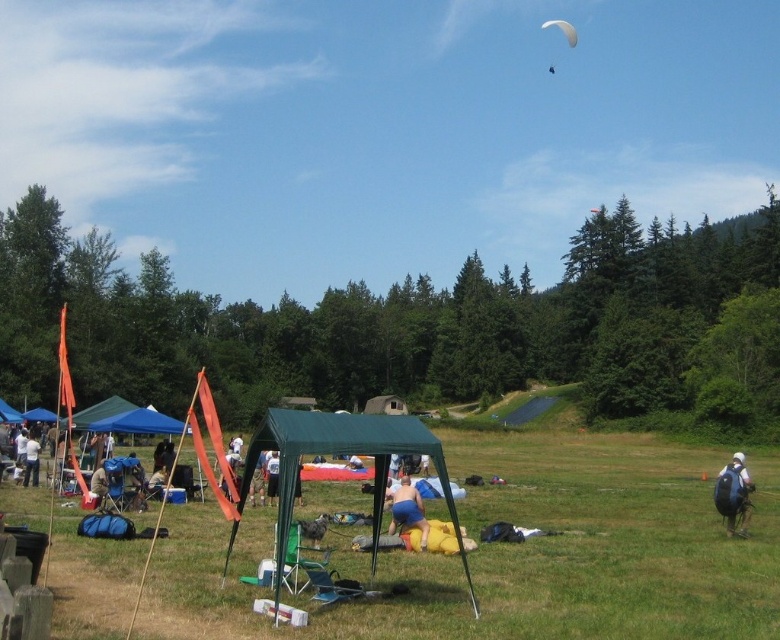
Is blue fabric tent at center below blue fabric canopy at lower left?

Correct, blue fabric tent at center is located below blue fabric canopy at lower left.

Between blue fabric tent at center and blue fabric canopy at lower left, which one appears on the left side from the viewer's perspective?

blue fabric canopy at lower left

Between point (273, 460) and point (36, 410), which one is positioned behind?

The point (36, 410) is behind.

Identify the location of blue fabric tent at center. The width and height of the screenshot is (780, 640). (273, 476).

Consider the image. Is green fabric tent at center to the left of camouflage pants at center from the viewer's perspective?

No, green fabric tent at center is not to the left of camouflage pants at center.

The height and width of the screenshot is (640, 780). What do you see at coordinates (348, 454) in the screenshot? I see `green fabric tent at center` at bounding box center [348, 454].

Who is more distant from viewer, (456, 525) or (261, 486)?

The point (261, 486) is behind.

Identify the location of green fabric tent at center. The height and width of the screenshot is (640, 780). (348, 454).

Between point (250, 490) and point (44, 412), which one is positioned in front?

Point (250, 490)

At what (x,y) coordinates should I click in order to perform the action: click on camouflage pants at center. Please return your answer as a coordinate pair (x, y). Looking at the image, I should click on (257, 480).

Where is `camouflage pants at center`? camouflage pants at center is located at coordinates (257, 480).